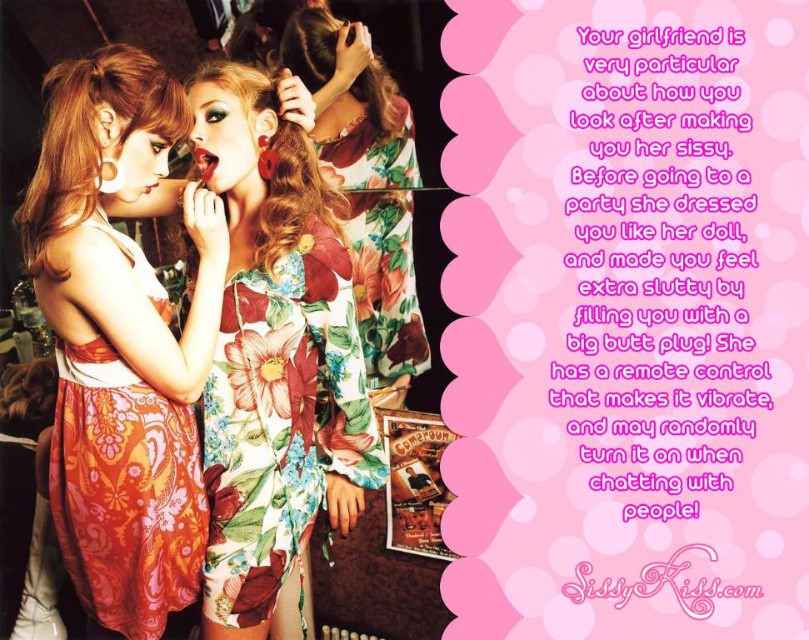
You are a photographer setting up for a portrait. You need to position a microphone so it can pick up both the blonde silky hair at left and the curly brown hair at upper center. Given their heights, where should you place the microphone?

The blonde silky hair at left is much taller than the curly brown hair at upper center, so placing the microphone at the level of the curly brown hair at upper center would ensure it captures both voices without needing to adjust for height differences.